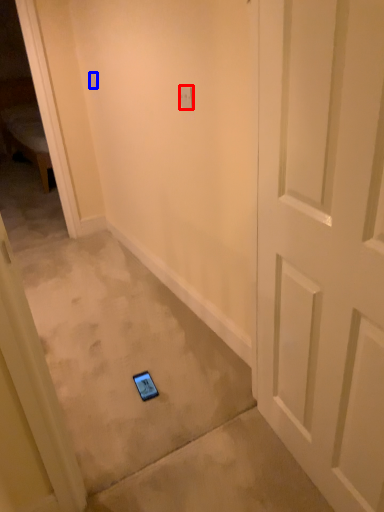
Question: Which object is closer to the camera taking this photo, light switch (highlighted by a red box) or light switch (highlighted by a blue box)?

Choices:
 (A) light switch
 (B) light switch

Answer: (A)